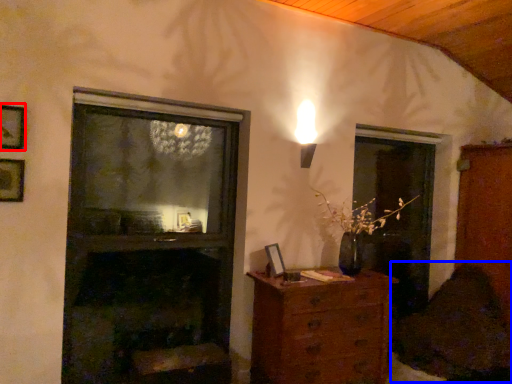
Question: Which of the following is the farthest to the observer, picture frame (highlighted by a red box) or swivel chair (highlighted by a blue box)?

Choices:
 (A) picture frame
 (B) swivel chair

Answer: (B)